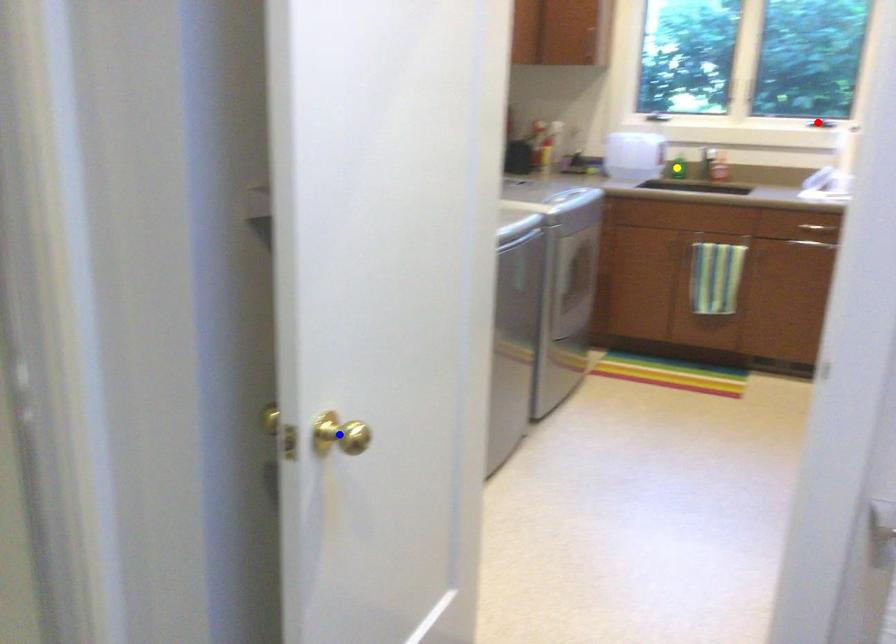
Order these from nearest to farthest:
1. blue point
2. red point
3. yellow point

1. blue point
2. red point
3. yellow point